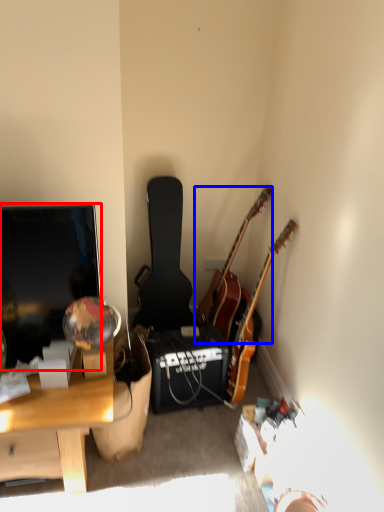
Question: Which object is further to the camera taking this photo, television (highlighted by a red box) or guitar (highlighted by a blue box)?

Choices:
 (A) television
 (B) guitar

Answer: (B)